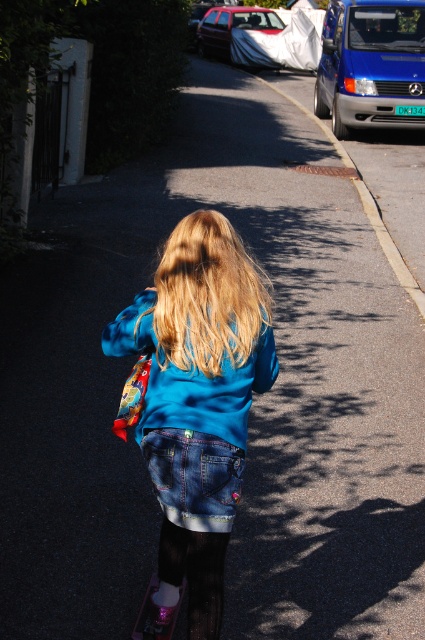
Question: Does blue metallic van at upper right have a greater width compared to blue satin jacket at center?

Choices:
 (A) no
 (B) yes

Answer: (B)

Question: Which point is farther to the camera?

Choices:
 (A) (274, 22)
 (B) (220, 248)

Answer: (A)

Question: Is blue denim jacket at center smaller than blonde silky hair at center?

Choices:
 (A) no
 (B) yes

Answer: (A)

Question: Is blonde silky hair at center above blue metallic van at upper right?

Choices:
 (A) yes
 (B) no

Answer: (B)

Question: Among these objects, which one is nearest to the camera?

Choices:
 (A) white matte car at upper center
 (B) blue denim jacket at center
 (C) blue metallic van at upper right

Answer: (B)

Question: Which of the following is the closest to the observer?

Choices:
 (A) (156, 314)
 (B) (212, 8)
 (C) (144, 342)

Answer: (A)